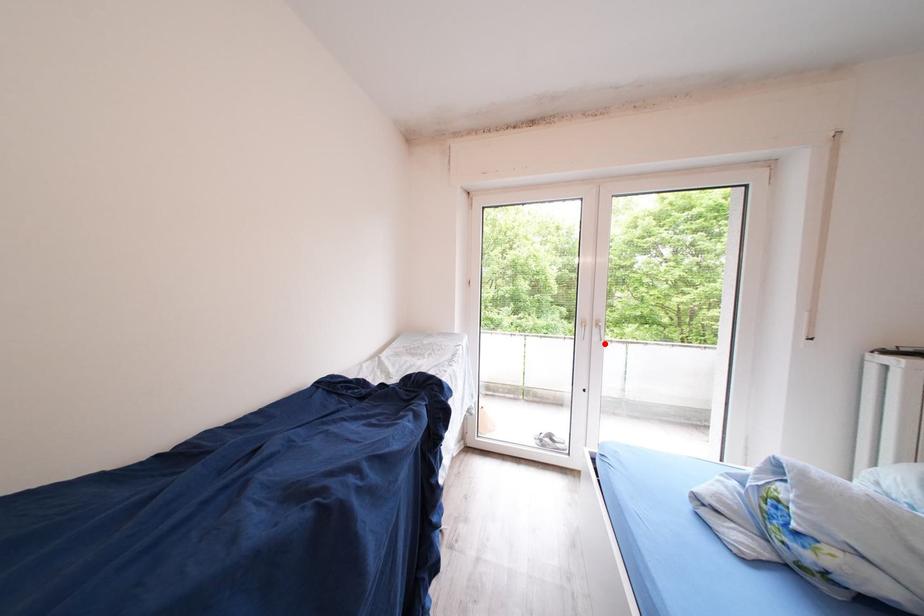
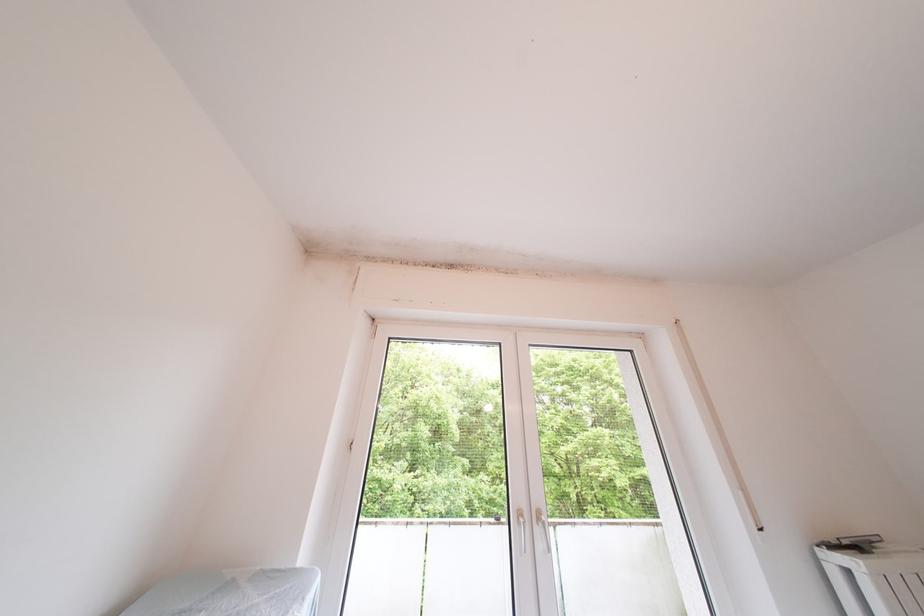
Locate, in the second image, the point that corresponds to the highlighted location in the first image.

(550, 552)